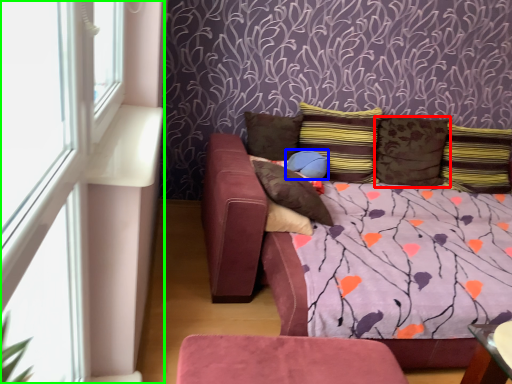
Question: Considering the real-world distances, which object is farthest from pillow (highlighted by a red box)? pillow (highlighted by a blue box) or window frame (highlighted by a green box)?

Choices:
 (A) pillow
 (B) window frame

Answer: (B)